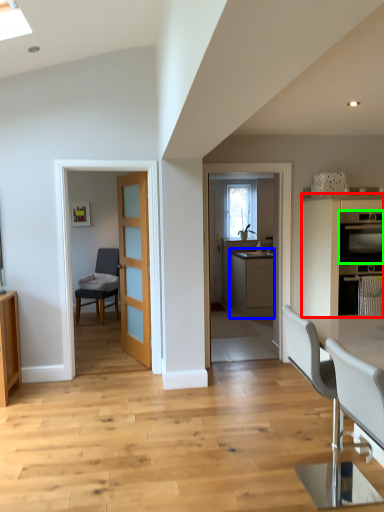
Question: Estimate the real-world distances between objects in this image. Which object is closer to cabinetry (highlighted by a red box), cabinetry (highlighted by a blue box) or kitchen appliance (highlighted by a green box)?

Choices:
 (A) cabinetry
 (B) kitchen appliance

Answer: (B)